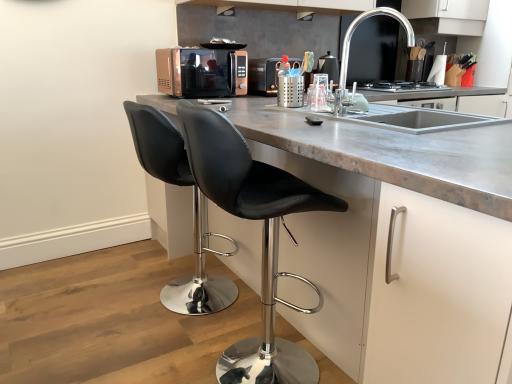
You are a GUI agent. You are given a task and a screenshot of the screen. Output one action in this format:
    pyautogui.click(x=<x>, y=<y>)
    Task: Click on the metallic microwave at center
    The height and width of the screenshot is (384, 512).
    Given the screenshot: What is the action you would take?
    pyautogui.click(x=263, y=76)

You are a GUI agent. You are given a task and a screenshot of the screen. Output one action in this format:
    pyautogui.click(x=<x>, y=<y>)
    Task: Click on the black leather stool at center, which ranks as the 2th chair in back-to-front order
    The image size is (512, 384).
    Given the screenshot: What is the action you would take?
    pyautogui.click(x=262, y=238)

How much space does matte black exhaust hood at upper center, which ranks as the second exhaust hood in front-to-back order, occupy horizontally?

matte black exhaust hood at upper center, which ranks as the second exhaust hood in front-to-back order, is 4.19 inches in width.

At what (x,y) coordinates should I click in order to perform the action: click on copper metallic microwave at center. Please return your answer as a coordinate pair (x, y). The image size is (512, 384). Looking at the image, I should click on [x=201, y=72].

Where is `white matte cabinet at center`? The image size is (512, 384). white matte cabinet at center is located at coordinates (397, 243).

Identify the location of black leather stool at lower left, positioned as the 1th chair in back-to-front order. The height and width of the screenshot is (384, 512). (193, 210).

What is the approximate height of metallic silver faucet at upper center?

metallic silver faucet at upper center is 8.78 inches in height.

In order to face metallic silver faucet at upper center, should I rotate leftwards or rightwards?

You should rotate right by 10.214 degrees.

Where is `black glass stove at center`? The width and height of the screenshot is (512, 384). black glass stove at center is located at coordinates (401, 86).

Considering the relative positions of copper metallic microwave at center and black matte exhaust hood at upper center, marked as the second exhaust hood in a back-to-front arrangement, in the image provided, is copper metallic microwave at center to the left of black matte exhaust hood at upper center, marked as the second exhaust hood in a back-to-front arrangement, from the viewer's perspective?

Correct, you'll find copper metallic microwave at center to the left of black matte exhaust hood at upper center, marked as the second exhaust hood in a back-to-front arrangement.

From the image's perspective, between copper metallic microwave at center and black matte exhaust hood at upper center, acting as the first exhaust hood starting from the left, who is located below?

copper metallic microwave at center, from the image's perspective.

Looking at this image, is copper metallic microwave at center far from black matte exhaust hood at upper center, the 1th exhaust hood when ordered from front to back?

That's not correct — copper metallic microwave at center is a little close to black matte exhaust hood at upper center, the 1th exhaust hood when ordered from front to back.

Is white matte cabinet at center facing away from polished chrome faucet at upper right?

No.

What's the angular difference between white matte cabinet at center and polished chrome faucet at upper right's facing directions?

51.4 degrees.

Considering the relative positions of white matte cabinet at center and polished chrome faucet at upper right in the image provided, is white matte cabinet at center to the left or to the right of polished chrome faucet at upper right?

white matte cabinet at center is to the left of polished chrome faucet at upper right.

Considering the sizes of objects white matte cabinet at center and polished chrome faucet at upper right in the image provided, who is smaller, white matte cabinet at center or polished chrome faucet at upper right?

Smaller between the two is polished chrome faucet at upper right.

In terms of width, does metallic microwave at center look wider or thinner when compared to white matte cabinet at center?

metallic microwave at center is thinner than white matte cabinet at center.

The width and height of the screenshot is (512, 384). What are the coordinates of `kitchen appliance located on the left of white matte cabinet at center` in the screenshot? It's located at (263, 76).

Is the surface of metallic microwave at center in direct contact with white matte cabinet at center?

No, metallic microwave at center is not touching white matte cabinet at center.

In the scene shown: Considering the sizes of metallic microwave at center and white matte cabinet at center in the image, is metallic microwave at center taller or shorter than white matte cabinet at center?

Clearly, metallic microwave at center is shorter compared to white matte cabinet at center.

From the image's perspective, is matte black exhaust hood at upper center, positioned as the 2th exhaust hood in bottom-to-top order, under black leather stool at center, which ranks as the 2th chair in back-to-front order?

No, from the image's perspective, matte black exhaust hood at upper center, positioned as the 2th exhaust hood in bottom-to-top order, is not beneath black leather stool at center, which ranks as the 2th chair in back-to-front order.

Considering the relative positions of matte black exhaust hood at upper center, which is the first exhaust hood from top to bottom, and black leather stool at center, which ranks as the 2th chair in back-to-front order, in the image provided, is matte black exhaust hood at upper center, which is the first exhaust hood from top to bottom, in front of black leather stool at center, which ranks as the 2th chair in back-to-front order,?

No, it is not.

Considering the sizes of matte black exhaust hood at upper center, which appears as the 1th exhaust hood when viewed from the back, and black leather stool at center, the first chair viewed from the front, in the image, is matte black exhaust hood at upper center, which appears as the 1th exhaust hood when viewed from the back, taller or shorter than black leather stool at center, the first chair viewed from the front,?

matte black exhaust hood at upper center, which appears as the 1th exhaust hood when viewed from the back, is shorter than black leather stool at center, the first chair viewed from the front.

Could you tell me if matte black exhaust hood at upper center, positioned as the first exhaust hood in right-to-left order, is facing black leather stool at center, which ranks as the 2th chair in back-to-front order?

No, matte black exhaust hood at upper center, positioned as the first exhaust hood in right-to-left order, is not aimed at black leather stool at center, which ranks as the 2th chair in back-to-front order.

From the image's perspective, which is below, black glass stove at center or polished chrome faucet at upper right?

From the image's view, polished chrome faucet at upper right is below.

What's the angular difference between black glass stove at center and polished chrome faucet at upper right's facing directions?

There is a 38.6-degree angle between the facing directions of black glass stove at center and polished chrome faucet at upper right.

Is black glass stove at center outside of polished chrome faucet at upper right?

Yes.

Is the position of metallic silver faucet at upper center more distant than that of black leather stool at lower left, the second chair viewed from the front?

Yes, the depth of metallic silver faucet at upper center is greater than that of black leather stool at lower left, the second chair viewed from the front.

From a real-world perspective, is metallic silver faucet at upper center physically above black leather stool at lower left, the second chair viewed from the front?

Yes.

Is metallic silver faucet at upper center touching black leather stool at lower left, positioned as the 1th chair in back-to-front order?

No.

Can we say metallic silver faucet at upper center lies outside black leather stool at lower left, positioned as the 1th chair in back-to-front order?

metallic silver faucet at upper center lies outside black leather stool at lower left, positioned as the 1th chair in back-to-front order,'s area.

From a real-world perspective, is black matte exhaust hood at upper center, which ranks as the first exhaust hood in bottom-to-top order, physically located above or below copper metallic microwave at center?

From a real-world perspective, black matte exhaust hood at upper center, which ranks as the first exhaust hood in bottom-to-top order, is physically above copper metallic microwave at center.

From the image's perspective, between black matte exhaust hood at upper center, the 1th exhaust hood when ordered from front to back, and copper metallic microwave at center, which one is located above?

From the image's view, black matte exhaust hood at upper center, the 1th exhaust hood when ordered from front to back, is above.

Between black matte exhaust hood at upper center, placed as the second exhaust hood when sorted from right to left, and copper metallic microwave at center, which one has more height?

copper metallic microwave at center is taller.

Where is `home appliance that appears below the black matte exhaust hood at upper center, the 1th exhaust hood when ordered from front to back (from the image's perspective)`? This screenshot has height=384, width=512. home appliance that appears below the black matte exhaust hood at upper center, the 1th exhaust hood when ordered from front to back (from the image's perspective) is located at coordinates (201, 72).

I want to click on cabinetry in front of the polished chrome faucet at upper right, so click(x=397, y=243).

Estimate the real-world distances between objects in this image. Which object is further from copper metallic microwave at center, metallic microwave at center or white matte cabinet at center?

white matte cabinet at center is positioned further to the anchor copper metallic microwave at center.

Which object lies nearer to the anchor point white matte cabinet at center, black matte exhaust hood at upper center, placed as the second exhaust hood when sorted from right to left, or polished chrome faucet at upper right?

polished chrome faucet at upper right lies closer to white matte cabinet at center than the other object.

From the image, which object appears to be nearer to metallic microwave at center, black matte exhaust hood at upper center, which ranks as the first exhaust hood in bottom-to-top order, or white matte cabinet at center?

The object closer to metallic microwave at center is black matte exhaust hood at upper center, which ranks as the first exhaust hood in bottom-to-top order.

From the image, which object appears to be nearer to copper metallic microwave at center, black glass stove at center or metallic microwave at center?

metallic microwave at center.

Estimate the real-world distances between objects in this image. Which object is closer to polished chrome faucet at upper right, black leather stool at center, the first chair viewed from the front, or black matte exhaust hood at upper center, placed as the second exhaust hood when sorted from right to left?

black matte exhaust hood at upper center, placed as the second exhaust hood when sorted from right to left, is positioned closer to the anchor polished chrome faucet at upper right.

Estimate the real-world distances between objects in this image. Which object is closer to black glass stove at center, copper metallic microwave at center or black matte exhaust hood at upper center, the 1th exhaust hood when ordered from front to back?

The object closer to black glass stove at center is copper metallic microwave at center.

From the image, which object appears to be nearer to copper metallic microwave at center, metallic microwave at center or black leather stool at center, which ranks as the 2th chair in back-to-front order?

Among the two, metallic microwave at center is located nearer to copper metallic microwave at center.

Based on their spatial positions, is metallic microwave at center or copper metallic microwave at center closer to metallic silver faucet at upper center?

The object closer to metallic silver faucet at upper center is metallic microwave at center.

Find the location of a particular element. The image size is (512, 384). kitchen appliance located between copper metallic microwave at center and metallic silver faucet at upper center in the left-right direction is located at coordinates (263, 76).

Find the location of `appliance positioned between black leather stool at lower left, the second chair viewed from the front, and matte black exhaust hood at upper center, which is the first exhaust hood from top to bottom, from near to far`. appliance positioned between black leather stool at lower left, the second chair viewed from the front, and matte black exhaust hood at upper center, which is the first exhaust hood from top to bottom, from near to far is located at coordinates (329, 67).

At what (x,y) coordinates should I click in order to perform the action: click on home appliance between black matte exhaust hood at upper center, the 2th exhaust hood from the top, and black leather stool at lower left, the second chair viewed from the front, from top to bottom. Please return your answer as a coordinate pair (x, y). The width and height of the screenshot is (512, 384). Looking at the image, I should click on (201, 72).

The height and width of the screenshot is (384, 512). Find the location of `home appliance positioned between white matte cabinet at center and black glass stove at center from near to far`. home appliance positioned between white matte cabinet at center and black glass stove at center from near to far is located at coordinates [201, 72].